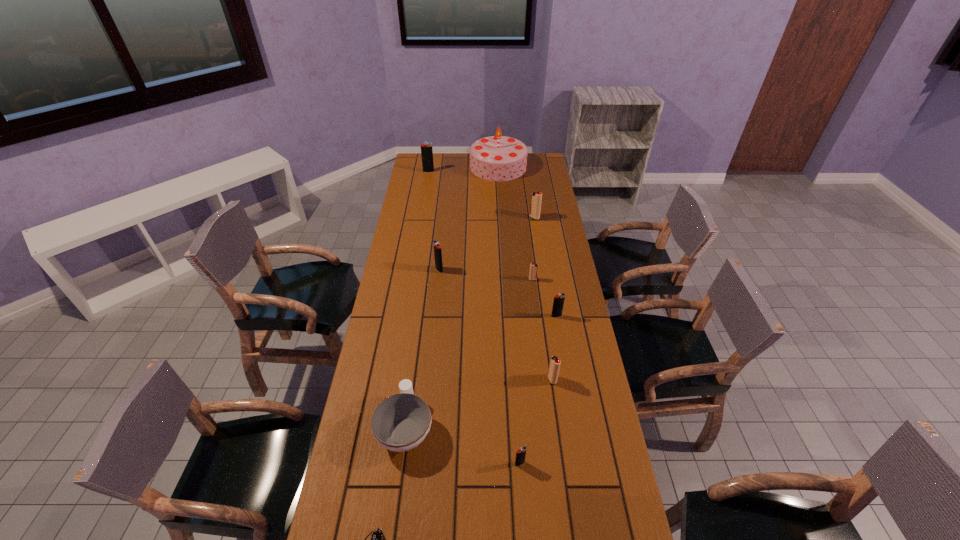
Identify which black igniter is the nearest to the nearest igniter. Please provide its 2D coordinates. Your answer should be formatted as a tuple, i.e. [(x, y)], where the tuple contains the x and y coordinates of a point satisfying the conditions above.

[(558, 302)]

Find the location of a particular element. Image resolution: width=960 pixels, height=540 pixels. red igniter that stands as the second closest to the second smallest red igniter is located at coordinates (x=536, y=198).

Select which red igniter is the second closest to the third black igniter from left to right. Please provide its 2D coordinates. Your answer should be formatted as a tuple, i.e. [(x, y)], where the tuple contains the x and y coordinates of a point satisfying the conditions above.

[(533, 272)]

I want to click on free spot that satisfies the following two spatial constraints: 1. on the side with the handle of the white chinaware; 2. on the left side of the seventh nearest object, so click(426, 270).

The height and width of the screenshot is (540, 960). I want to click on vacant space that satisfies the following two spatial constraints: 1. on the side with the handle of the white chinaware; 2. on the left side of the rightmost black igniter, so click(420, 316).